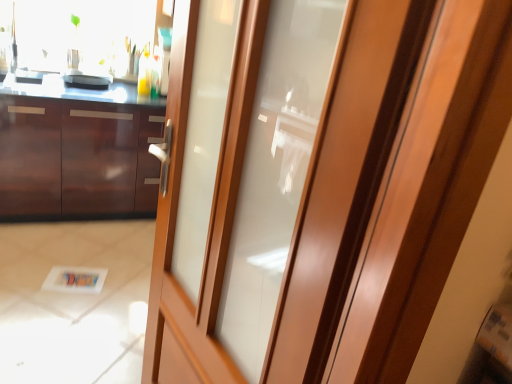
Identify the location of matte wood door at center. (318, 183).

What do you see at coordinates (77, 157) in the screenshot? Image resolution: width=512 pixels, height=384 pixels. I see `glossy wood cabinetry at left` at bounding box center [77, 157].

Where is `matte black pan at upper left`? Image resolution: width=512 pixels, height=384 pixels. matte black pan at upper left is located at coordinates (x=87, y=80).

From a real-world perspective, which is physically above, matte wood door at center or glossy wood cabinetry at left?

matte wood door at center.

In terms of size, does matte wood door at center appear bigger or smaller than glossy wood cabinetry at left?

Considering their sizes, matte wood door at center takes up less space than glossy wood cabinetry at left.

Find the location of a particular element. cabinetry to the left of matte wood door at center is located at coordinates (77, 157).

How many degrees apart are the facing directions of matte wood door at center and glossy wood cabinetry at left?

81.9 degrees separate the facing orientations of matte wood door at center and glossy wood cabinetry at left.

Is point (80, 73) behind point (312, 247)?

Yes, point (80, 73) is behind point (312, 247).

Are matte black pan at upper left and matte wood door at center beside each other?

No, matte black pan at upper left is not with matte wood door at center.

Would you say matte black pan at upper left is inside or outside matte wood door at center?

matte black pan at upper left is outside matte wood door at center.

Can you confirm if matte wood door at center is positioned to the right of matte black pan at upper left?

Indeed, matte wood door at center is positioned on the right side of matte black pan at upper left.

Find the location of a particular element. This screenshot has width=512, height=384. door lying below the matte black pan at upper left (from the image's perspective) is located at coordinates (318, 183).

From a real-world perspective, is matte wood door at center physically located above or below matte black pan at upper left?

Clearly, from a real-world perspective, matte wood door at center is below matte black pan at upper left.

Is matte black pan at upper left a part of matte wood door at center?

No.

Which object is further away from the camera, matte black pan at upper left or glossy wood cabinetry at left?

matte black pan at upper left is further away from the camera.

How different are the orientations of matte black pan at upper left and glossy wood cabinetry at left in degrees?

matte black pan at upper left and glossy wood cabinetry at left are facing 2.09 degrees away from each other.

Based on the photo, is matte black pan at upper left facing away from glossy wood cabinetry at left?

No.

Between matte black pan at upper left and glossy wood cabinetry at left, which one has more height?

glossy wood cabinetry at left is taller.

From the image's perspective, is glossy wood cabinetry at left positioned above or below matte wood door at center?

From the image's perspective, glossy wood cabinetry at left appears above matte wood door at center.

Is point (106, 185) closer or farther from the camera than point (245, 59)?

Point (106, 185) is positioned farther from the camera compared to point (245, 59).

From a real-world perspective, who is located lower, glossy wood cabinetry at left or matte wood door at center?

glossy wood cabinetry at left, from a real-world perspective.

Is glossy wood cabinetry at left taller or shorter than matte wood door at center?

Clearly, glossy wood cabinetry at left is shorter compared to matte wood door at center.

From a real-world perspective, is glossy wood cabinetry at left positioned under matte black pan at upper left based on gravity?

Correct, in the physical world, glossy wood cabinetry at left is lower than matte black pan at upper left.

Based on the photo, which of these two, glossy wood cabinetry at left or matte black pan at upper left, is thinner?

With smaller width is matte black pan at upper left.

Is matte black pan at upper left completely or partially inside glossy wood cabinetry at left?

That's incorrect, matte black pan at upper left is not inside glossy wood cabinetry at left.

In the image, there is a matte wood door at center. What are the coordinates of `cabinetry below it (from a real-world perspective)` in the screenshot? It's located at (77, 157).

This screenshot has height=384, width=512. In order to click on door in front of the matte black pan at upper left in this screenshot , I will do `click(318, 183)`.

Considering their positions, is glossy wood cabinetry at left positioned further to matte black pan at upper left than matte wood door at center?

matte wood door at center.

Consider the image. When comparing their distances from matte wood door at center, does glossy wood cabinetry at left or matte black pan at upper left seem closer?

Among the two, glossy wood cabinetry at left is located nearer to matte wood door at center.

When comparing their distances from matte wood door at center, does matte black pan at upper left or glossy wood cabinetry at left seem closer?

glossy wood cabinetry at left.

Looking at the image, which one is located further to glossy wood cabinetry at left, matte wood door at center or matte black pan at upper left?

Among the two, matte wood door at center is located further to glossy wood cabinetry at left.

Looking at the image, which one is located closer to glossy wood cabinetry at left, matte black pan at upper left or matte wood door at center?

The object closer to glossy wood cabinetry at left is matte black pan at upper left.

When comparing their distances from matte black pan at upper left, does matte wood door at center or glossy wood cabinetry at left seem further?

matte wood door at center is positioned further to the anchor matte black pan at upper left.

At what (x,y) coordinates should I click in order to perform the action: click on cabinetry between matte wood door at center and matte black pan at upper left in the front-back direction. Please return your answer as a coordinate pair (x, y). The width and height of the screenshot is (512, 384). Looking at the image, I should click on (77, 157).